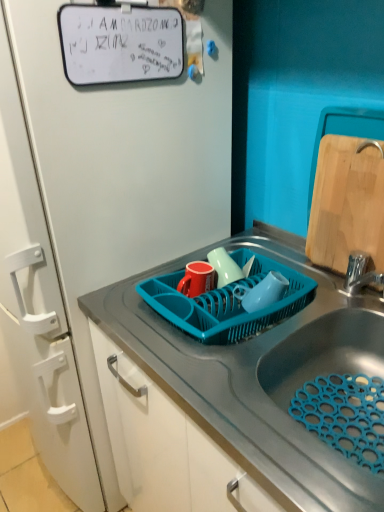
Question: Does point (355, 225) appear closer or farther from the camera than point (347, 360)?

Choices:
 (A) farther
 (B) closer

Answer: (A)

Question: From a real-world perspective, relative to metallic sink at center, is wooden cutting board at right vertically above or below?

Choices:
 (A) above
 (B) below

Answer: (A)

Question: Estimate the real-world distances between objects in this image. Which object is farther from the wooden cutting board at right?

Choices:
 (A) teal plastic dish rack at center
 (B) metallic sink at center

Answer: (B)

Question: Which object is positioned farthest from the metallic sink at center?

Choices:
 (A) teal plastic dish rack at center
 (B) wooden cutting board at right

Answer: (B)